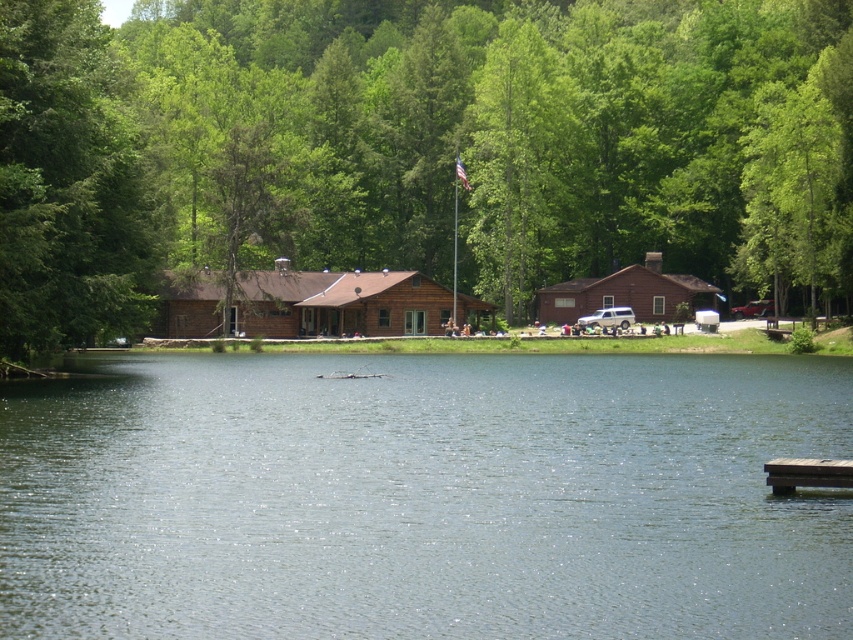
Question: Which is farther from the brown wooden cabin at center?

Choices:
 (A) brown wood cabin at center
 (B) clear water at center
 (C) brown wooden dock at lower right

Answer: (C)

Question: Based on their relative distances, which object is nearer to the brown wooden cabin at center?

Choices:
 (A) brown wood cabin at center
 (B) brown wooden dock at lower right
 (C) clear water at center
 (D) green leafy tree at upper center

Answer: (A)

Question: Can you confirm if green leafy tree at upper center is wider than brown wooden cabin at center?

Choices:
 (A) no
 (B) yes

Answer: (B)

Question: Does green leafy tree at upper center lie in front of brown wooden cabin at center?

Choices:
 (A) yes
 (B) no

Answer: (A)

Question: Is brown wooden cabin at center behind brown wood cabin at center?

Choices:
 (A) yes
 (B) no

Answer: (B)

Question: Which of the following is the closest to the observer?

Choices:
 (A) brown wooden cabin at center
 (B) green leafy tree at upper center
 (C) brown wooden dock at lower right
 (D) brown wood cabin at center

Answer: (C)